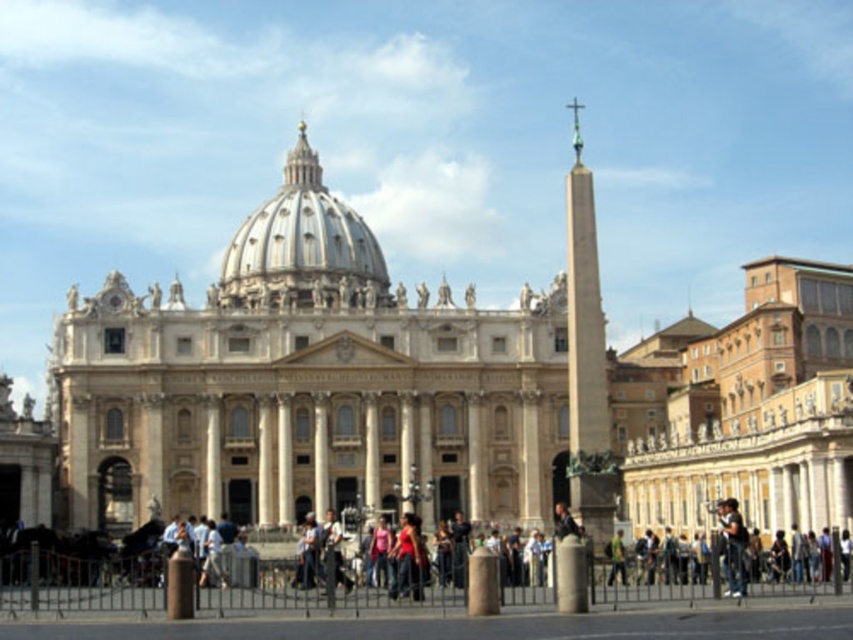
You are standing in the plaza in front of the cathedral and want to take a photo of the white marble dome at center without any people in the frame. The dark blue jeans at lower right belong to a tourist blocking your view. Which direction should you move to avoid them?

Move to the left side to position yourself so the white marble dome at center is to the left of the dark blue jeans at lower right, thus avoiding the tourist.

Looking at this image, you are standing in the plaza in front of the cathedral. You want to take a photo of the white marble dome at center. Where should you position yourself to capture the dome in the frame?

To capture the white marble dome at center in your photo, position yourself at point (303, 246) where the dome is located.

You are a photographer aiming to capture the grandeur of the cathedral. You notice the white marble dome at center and the dark blue jeans at lower right in your frame. Which object should you focus on to emphasize the scale and dominance in your composition?

The white marble dome at center is larger in size than the dark blue jeans at lower right, so focusing on the white marble dome at center will emphasize its grandeur and dominance in the composition.